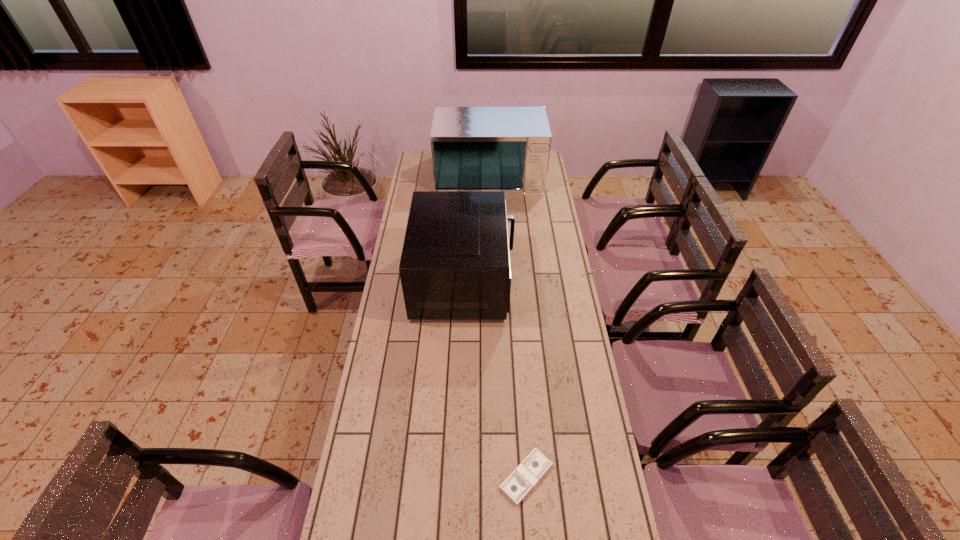
Image resolution: width=960 pixels, height=540 pixels. Identify the location of free region that satisfies the following two spatial constraints: 1. on the front-facing side of the dollar; 2. on the right side of the farther microwave_oven. (498, 477).

Find the location of a particular element. free space that satisfies the following two spatial constraints: 1. on the front-facing side of the farthest object; 2. on the left side of the shortest object is located at coordinates (498, 477).

At what (x,y) coordinates should I click in order to perform the action: click on free space that satisfies the following two spatial constraints: 1. on the front-facing side of the farther microwave_oven; 2. on the left side of the nearest object. Please return your answer as a coordinate pair (x, y). The image size is (960, 540). Looking at the image, I should click on (498, 477).